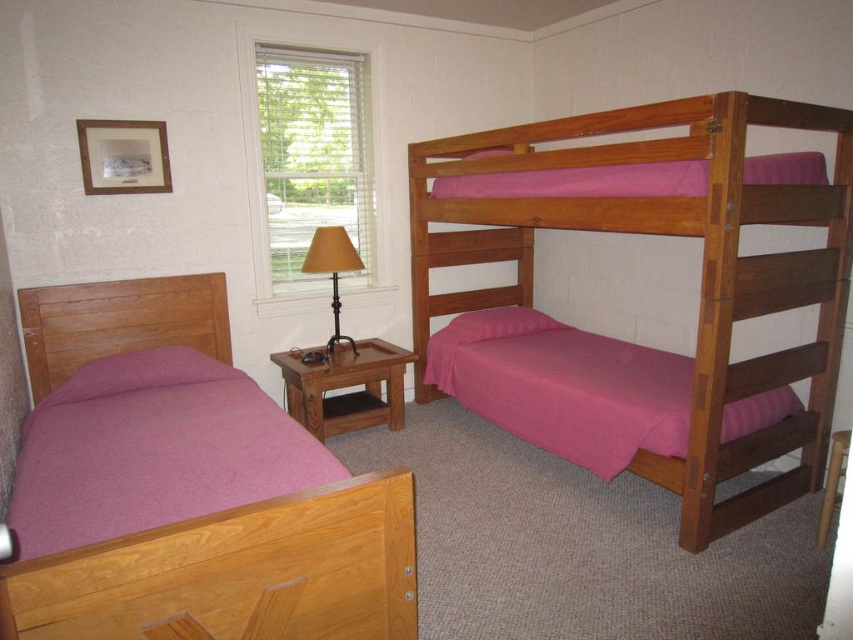
You are standing in the center of the bedroom and see two points marked in the image. Which point, point (415, 184) or point (102, 438), is closer to you?

Point (415, 184) is closer to you because it is further to the viewer than point (102, 438).